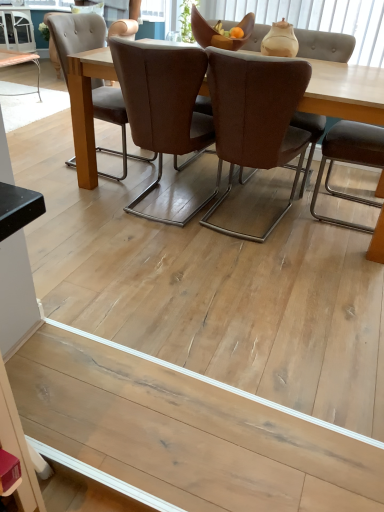
Where is `vacant space that is in between brown fabric chair at center, which appears as the second chair when viewed from the left, and brown leather chair at right, which ranks as the first chair in right-to-left order`? The height and width of the screenshot is (512, 384). vacant space that is in between brown fabric chair at center, which appears as the second chair when viewed from the left, and brown leather chair at right, which ranks as the first chair in right-to-left order is located at coordinates (294, 212).